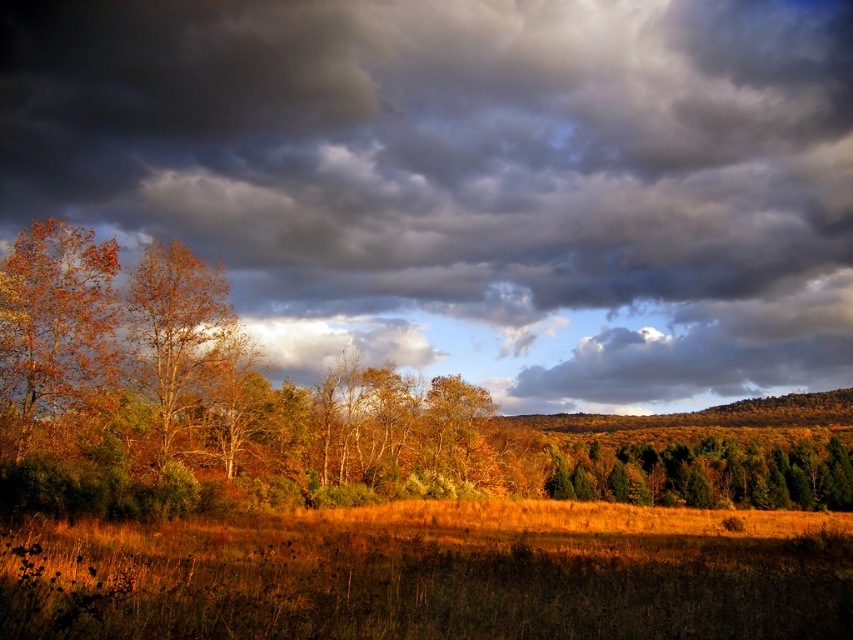
Question: Which object appears farthest from the camera in this image?

Choices:
 (A) golden grass at lower center
 (B) green matte trees at center
 (C) orange matte tree at left

Answer: (B)

Question: Which of the following is the closest to the observer?

Choices:
 (A) orange matte tree at left
 (B) autumn foliage at center
 (C) golden grass at lower center

Answer: (C)

Question: Which point is farther to the camera?

Choices:
 (A) orange-brown foliage at left
 (B) autumn foliage at center

Answer: (A)

Question: Is orange-brown foliage at left positioned before green matte trees at center?

Choices:
 (A) no
 (B) yes

Answer: (B)

Question: Can you confirm if autumn foliage at center is thinner than orange-brown foliage at left?

Choices:
 (A) no
 (B) yes

Answer: (A)

Question: Is autumn foliage at center bigger than orange-brown foliage at left?

Choices:
 (A) no
 (B) yes

Answer: (B)